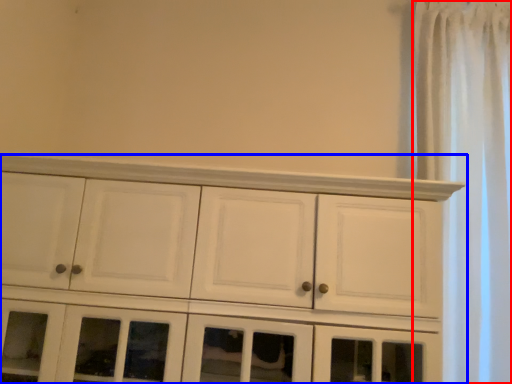
Question: Among these objects, which one is nearest to the camera, shower curtain (highlighted by a red box) or cupboard (highlighted by a blue box)?

Choices:
 (A) shower curtain
 (B) cupboard

Answer: (B)